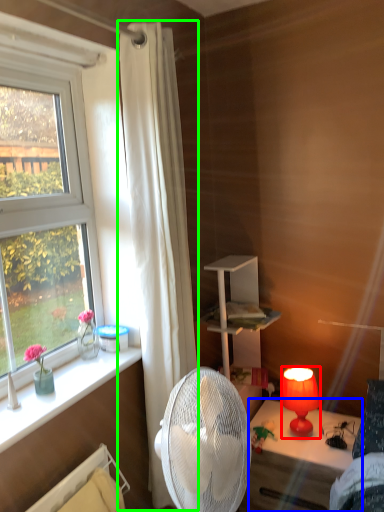
Question: Based on their relative distances, which object is farther from lamp (highlighted by a red box)? Choose from desk (highlighted by a blue box) and curtain (highlighted by a green box).

Choices:
 (A) desk
 (B) curtain

Answer: (B)